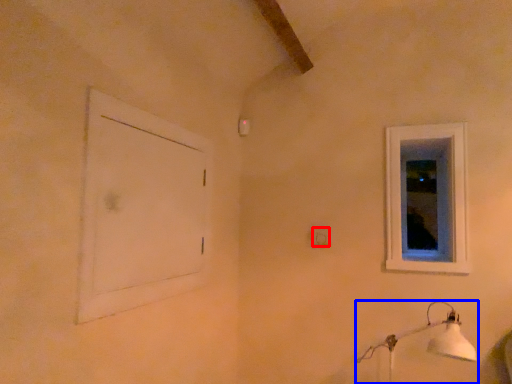
Question: Which of the following is the farthest to the observer, electric outlet (highlighted by a red box) or lamp (highlighted by a blue box)?

Choices:
 (A) electric outlet
 (B) lamp

Answer: (A)